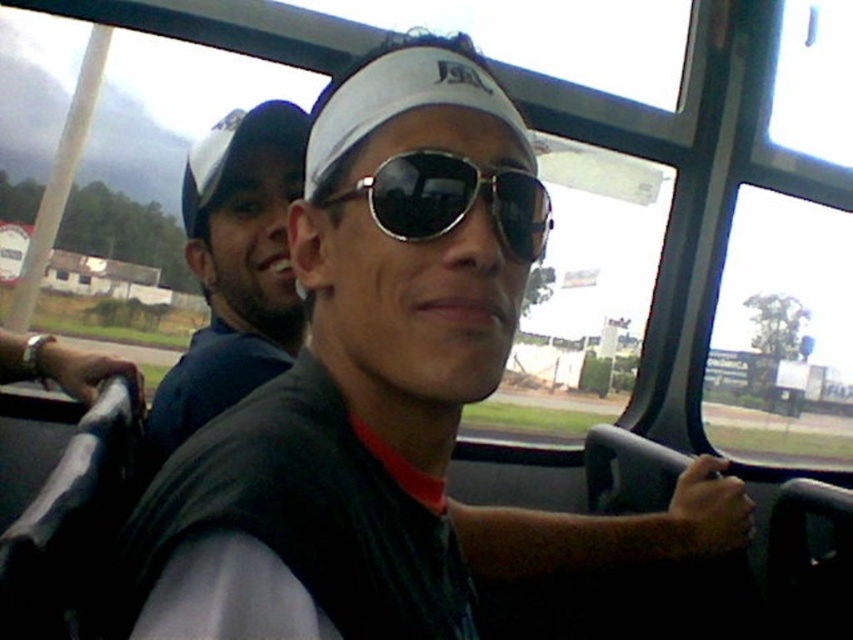
Question: Observing the image, what is the correct spatial positioning of blue fabric cap at upper left in reference to sunglasses at center?

Choices:
 (A) left
 (B) right

Answer: (A)

Question: Which point is farther from the camera taking this photo?

Choices:
 (A) (239, 349)
 (B) (396, 188)

Answer: (A)

Question: Does blue fabric cap at upper left have a lesser width compared to sunglasses at center?

Choices:
 (A) yes
 (B) no

Answer: (B)

Question: Which point is closer to the camera?

Choices:
 (A) (431, 179)
 (B) (231, 266)

Answer: (A)

Question: Does blue fabric cap at upper left appear on the left side of sunglasses at center?

Choices:
 (A) yes
 (B) no

Answer: (A)